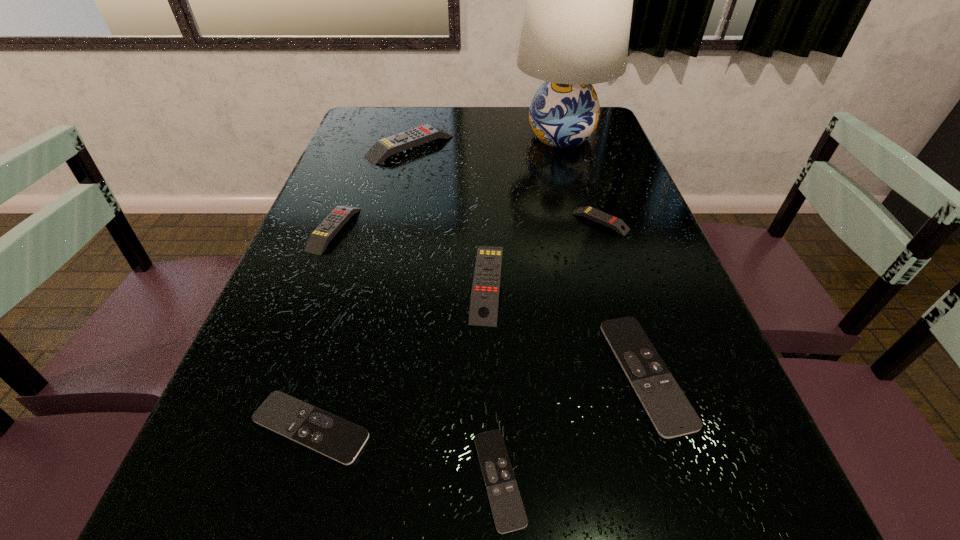
Identify the location of yellow remote control that stands as the third closest to the second biggest yellow remote control. This screenshot has width=960, height=540. (382, 149).

Locate an element on the screen. The image size is (960, 540). yellow remote control that is the closest to the fourth shortest remote control is located at coordinates (484, 301).

Identify which black remote control is the second closest to the farthest remote control. Please provide its 2D coordinates. Your answer should be formatted as a tuple, i.e. [(x, y)], where the tuple contains the x and y coordinates of a point satisfying the conditions above.

[(321, 431)]

Locate an element on the screen. Image resolution: width=960 pixels, height=540 pixels. black remote control object that ranks as the second closest to the leftmost black remote control is located at coordinates (672, 415).

You are a GUI agent. You are given a task and a screenshot of the screen. Output one action in this format:
    pyautogui.click(x=<x>, y=<y>)
    Task: Click on the free space that satisfies the following two spatial constraints: 1. on the front side of the second smallest yellow remote control; 2. on the right side of the third yellow remote control from left to right
    
    Given the screenshot: What is the action you would take?
    pyautogui.click(x=314, y=282)

This screenshot has height=540, width=960. I want to click on vacant region that satisfies the following two spatial constraints: 1. on the back side of the second smallest yellow remote control; 2. on the right side of the farthest remote control, so click(x=366, y=146).

You are a GUI agent. You are given a task and a screenshot of the screen. Output one action in this format:
    pyautogui.click(x=<x>, y=<y>)
    Task: Click on the free space that satisfies the following two spatial constraints: 1. on the back side of the smallest black remote control; 2. on the right side of the third shortest object
    
    Given the screenshot: What is the action you would take?
    pyautogui.click(x=496, y=374)

The image size is (960, 540). In order to click on free location that satisfies the following two spatial constraints: 1. on the back side of the rightmost yellow remote control; 2. on the right side of the third biggest yellow remote control in this screenshot , I will do `click(337, 221)`.